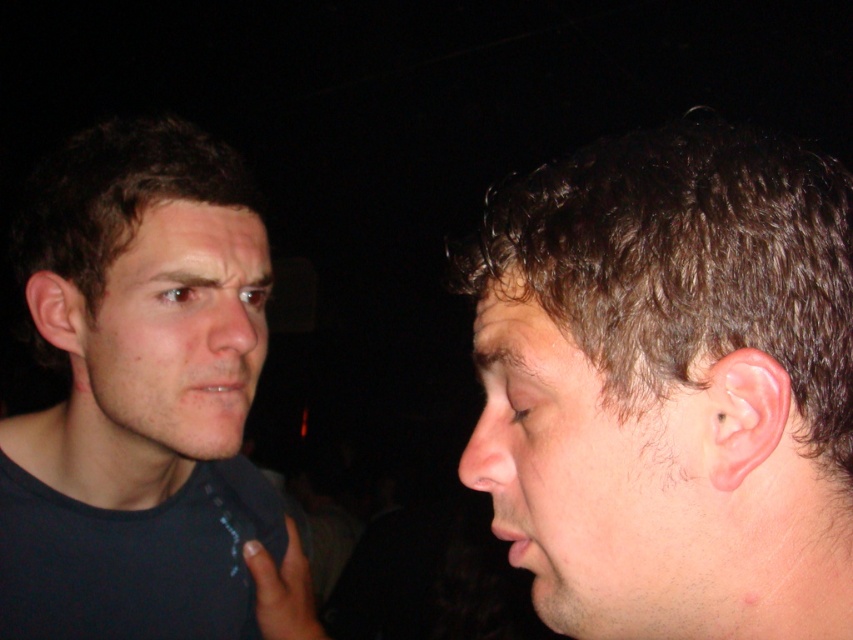
Based on the photo, can you confirm if dark brown hair at right is shorter than pale skin face at left?

No.

Who is taller, dark brown hair at right or pale skin face at left?

Standing taller between the two is dark brown hair at right.

Is point (819, 248) positioned after point (140, 419)?

No, it is not.

Locate an element on the screen. dark brown hair at right is located at coordinates (671, 387).

Is point (721, 397) in front of point (540, 600)?

Yes.

Is dark brown hair at right to the right of pale skin at right from the viewer's perspective?

Indeed, dark brown hair at right is positioned on the right side of pale skin at right.

Is point (622, 492) more distant than point (527, 296)?

No, it is in front of (527, 296).

The image size is (853, 640). In order to click on dark brown hair at right in this screenshot , I will do `click(671, 387)`.

Image resolution: width=853 pixels, height=640 pixels. What do you see at coordinates (595, 480) in the screenshot?
I see `pale skin at right` at bounding box center [595, 480].

Does pale skin at right lie behind pale skin face at left?

No.

Locate an element on the screen. pale skin at right is located at coordinates [595, 480].